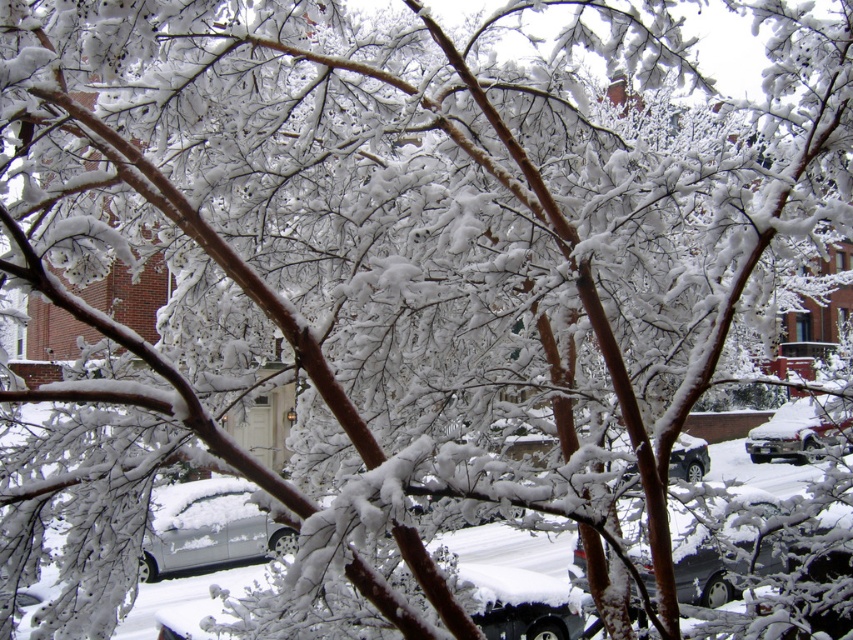
You are a delivery driver who needs to park your vehicle in this winter scene. You have a delivery van that is 1.8 meters tall. Can both the silver metallic suv at lower right and the black matte suv at center fit under a low clearance bridge that is 2 meters tall?

The silver metallic suv at lower right is taller than the black matte suv at center. Since the bridge has a 2 meter clearance, the silver metallic suv at lower right may not fit if its height exceeds 2 meters. The black matte suv at center, being shorter, would likely fit under the bridge. However, the delivery van at 1.8 meters would also fit under the bridge as it is below the 2 meter limit.

Consider the image. You are a delivery person needing to park your 7.5 feet long delivery van between the silver metallic suv at lower right and the black matte suv at center. Is there enough space between them for your van?

The distance between the silver metallic suv at lower right and the black matte suv at center is 9.43 feet. Since your van is 7.5 feet long, there is sufficient space to park between them.

You are a delivery person trying to park your van between the silver metallic car at lower left and the silver metallic suv at lower right. Which vehicle should you position your van closer to if you want to maximize the space available for your van?

You should position your van closer to the silver metallic car at lower left because it is smaller than the silver metallic suv at lower right, providing more space for the van.